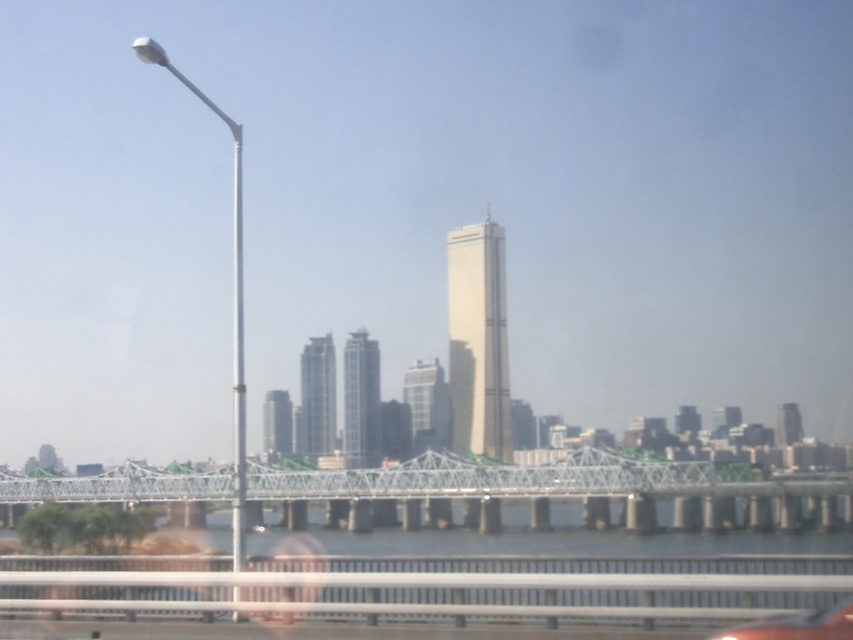
Question: Considering the relative positions of metallic gray bridge at center and metallic silver car at lower center in the image provided, where is metallic gray bridge at center located with respect to metallic silver car at lower center?

Choices:
 (A) right
 (B) left

Answer: (B)

Question: Is metallic gray bridge at center wider than metallic silver car at lower center?

Choices:
 (A) no
 (B) yes

Answer: (B)

Question: Can you confirm if metallic gray bridge at center is smaller than metallic silver car at lower center?

Choices:
 (A) no
 (B) yes

Answer: (A)

Question: Among these objects, which one is farthest from the camera?

Choices:
 (A) metallic silver car at lower center
 (B) metallic gray bridge at center

Answer: (B)